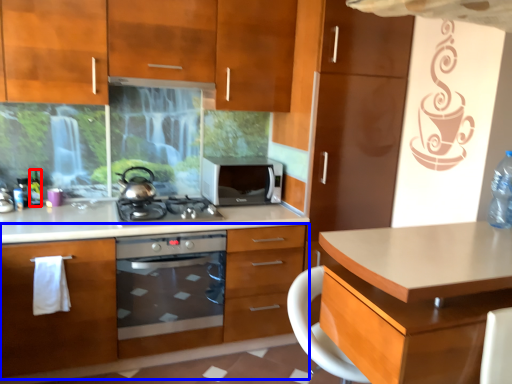
Question: Which of the following is the closest to the observer, bottle (highlighted by a red box) or cabinetry (highlighted by a blue box)?

Choices:
 (A) bottle
 (B) cabinetry

Answer: (B)